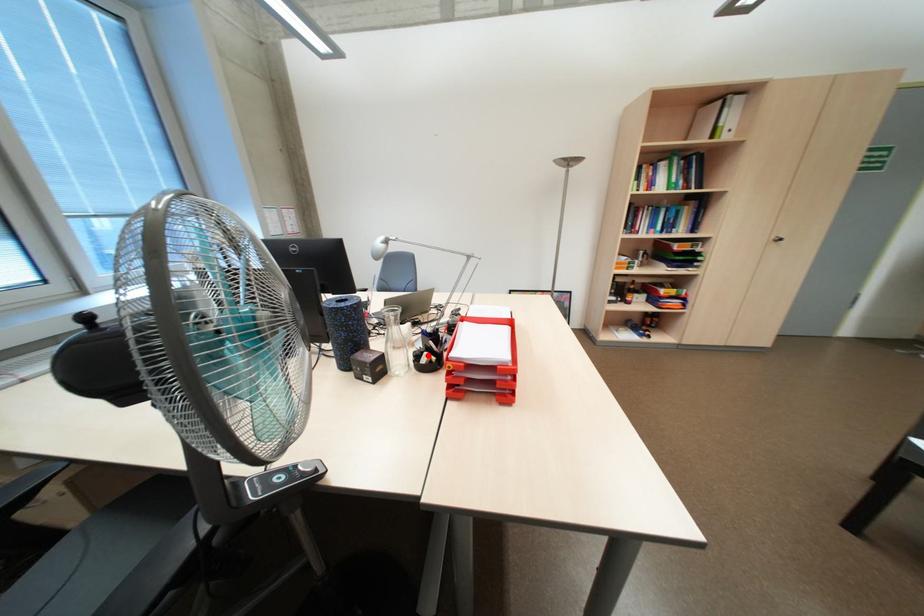
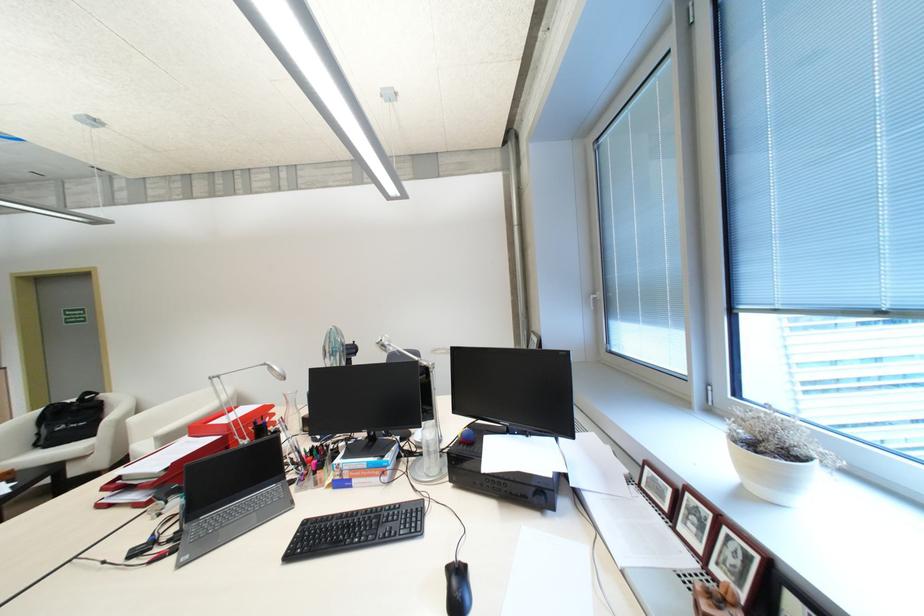
Question: I am providing you with two images of the same scene from different viewpoints. A red point is marked on the first image. Is the red point's position out of view in image 2?

Choices:
 (A) Yes
 (B) No

Answer: (A)